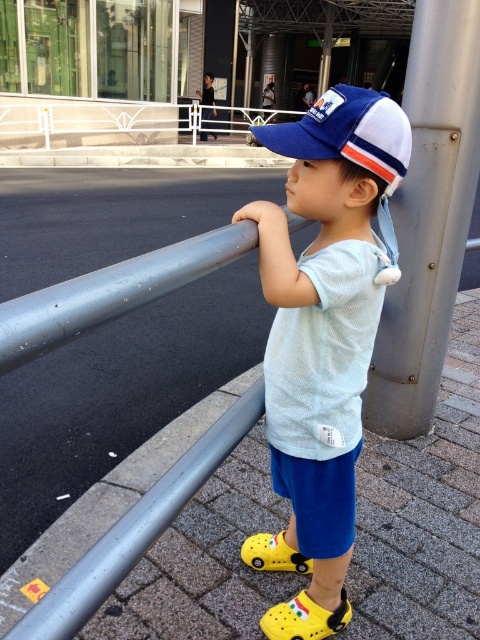
Question: Which of the following is the closest to the observer?

Choices:
 (A) (269, 627)
 (B) (359, 113)
 (C) (376, 385)

Answer: (B)

Question: Is rusty metal pole at right thinner than yellow croc shoe at lower center?

Choices:
 (A) yes
 (B) no

Answer: (B)

Question: Is rusty metal pole at right wider than yellow croc shoe at lower center?

Choices:
 (A) no
 (B) yes

Answer: (B)

Question: Estimate the real-world distances between objects in this image. Which object is closer to the yellow rubber crocs at lower center?

Choices:
 (A) blue mesh baseball cap at center
 (B) matte blue cap at center

Answer: (B)

Question: Observing the image, what is the correct spatial positioning of yellow rubber crocs at lower center in reference to yellow croc shoe at lower center?

Choices:
 (A) left
 (B) right

Answer: (B)

Question: Which of these objects is positioned farthest from the rusty metal pole at right?

Choices:
 (A) yellow croc shoe at lower center
 (B) matte blue cap at center

Answer: (A)